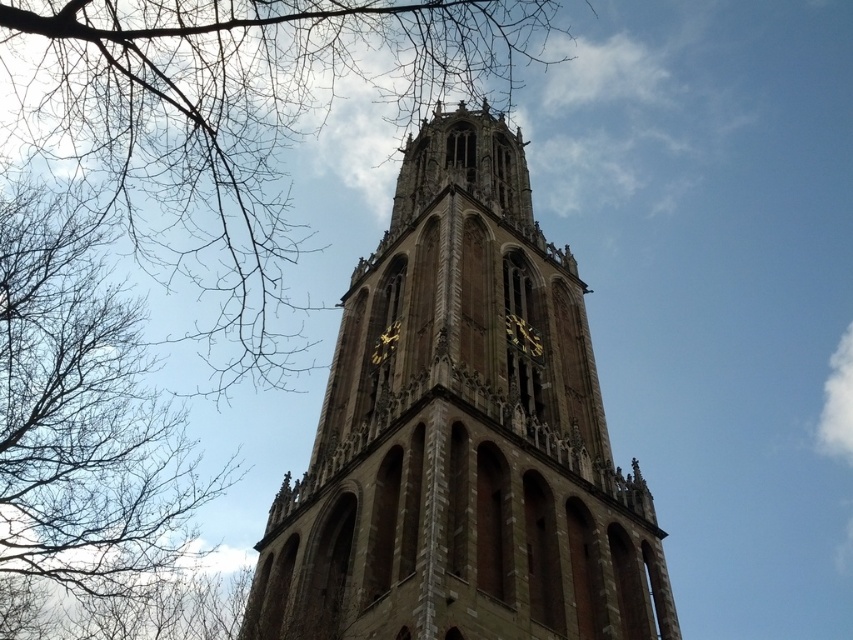
You are a bird looking for a higher perch. You see the bare branches at upper left and the brown leafless branches at left. Which one should you choose to find a higher spot?

The bare branches at upper left is much taller as brown leafless branches at left, so you should choose the bare branches at upper left to find a higher spot.

You are an artist sketching the tower and need to decide which branches to focus on first based on their size. Which of the two branches, the bare branches at upper left or the brown leafless branches at left, is wider?

The bare branches at upper left are wider than the brown leafless branches at left.

You are an architect planning to install a decorative banner between the brown stone tower at center and the bare branches at upper left. Which one has a narrower width to ensure the banner fits properly?

The brown stone tower at center has a narrower width than the bare branches at upper left, so the banner should be sized according to the tower to fit properly.